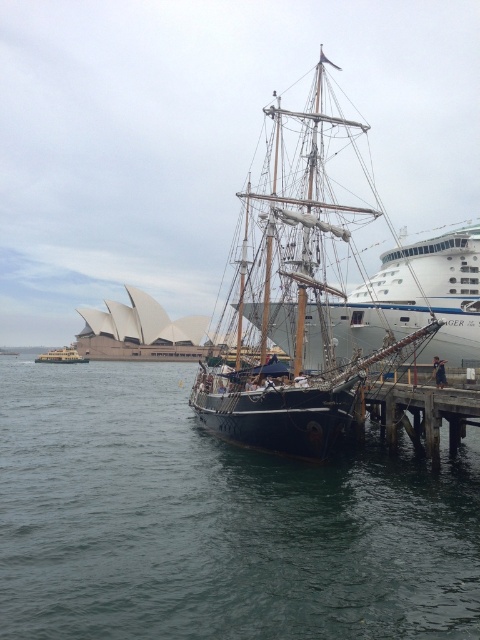
Is dark blue water at center to the right of wooden pier at lower right from the viewer's perspective?

In fact, dark blue water at center is to the left of wooden pier at lower right.

Find the location of a particular element. This screenshot has width=480, height=640. dark blue water at center is located at coordinates (216, 522).

Image resolution: width=480 pixels, height=640 pixels. In order to click on dark blue water at center in this screenshot , I will do `click(216, 522)`.

Can you confirm if dark blue water at center is wider than dark wood ship at center?

Indeed, dark blue water at center has a greater width compared to dark wood ship at center.

From the picture: Is dark blue water at center above dark wood ship at center?

Actually, dark blue water at center is below dark wood ship at center.

The width and height of the screenshot is (480, 640). Describe the element at coordinates (216, 522) in the screenshot. I see `dark blue water at center` at that location.

Locate an element on the screen. This screenshot has width=480, height=640. dark blue water at center is located at coordinates (216, 522).

Does white glossy cruise ship at center have a greater width compared to yellow matte ferry at lower left?

Correct, the width of white glossy cruise ship at center exceeds that of yellow matte ferry at lower left.

Does white glossy cruise ship at center have a greater height compared to yellow matte ferry at lower left?

Yes.

Where is `white glossy cruise ship at center`? white glossy cruise ship at center is located at coordinates (416, 300).